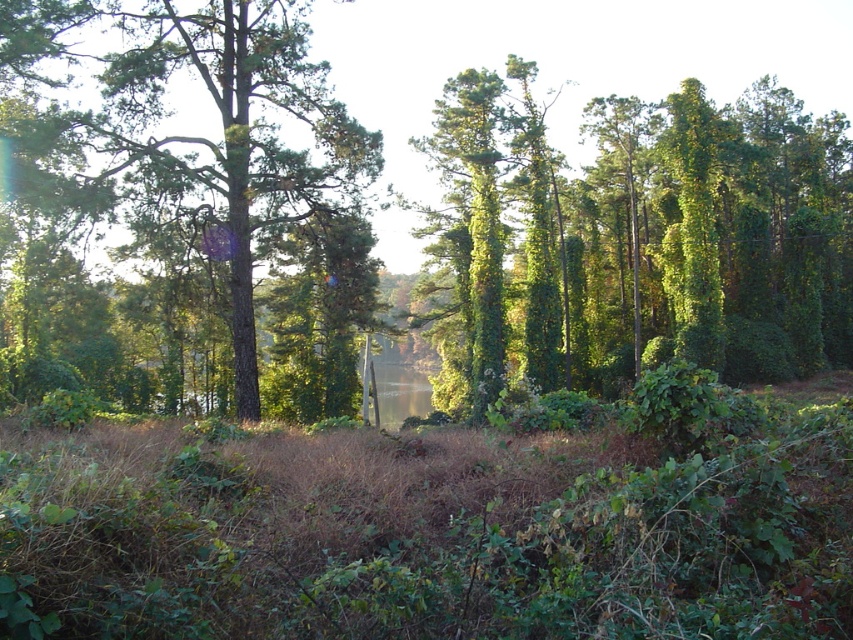
Question: Which point is closer to the camera taking this photo?

Choices:
 (A) (718, 118)
 (B) (215, 225)

Answer: (B)

Question: Is green leafy tree at upper center below green matte tree at center?

Choices:
 (A) yes
 (B) no

Answer: (A)

Question: Does green leafy tree at upper center appear over green matte tree at center?

Choices:
 (A) no
 (B) yes

Answer: (A)

Question: Which point is farther from the camera taking this photo?

Choices:
 (A) (223, 234)
 (B) (474, 196)

Answer: (B)

Question: Observing the image, what is the correct spatial positioning of green leafy tree at upper center in reference to green matte tree at center?

Choices:
 (A) right
 (B) left

Answer: (A)